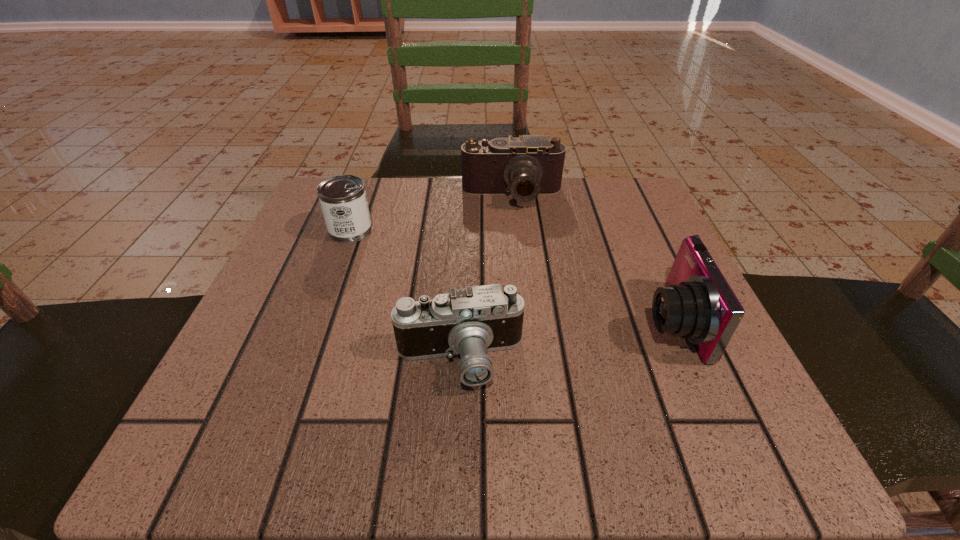
Find the location of a particular element. The width and height of the screenshot is (960, 540). can that is at the far edge is located at coordinates (343, 200).

Image resolution: width=960 pixels, height=540 pixels. I want to click on object present at the left edge, so click(343, 200).

The image size is (960, 540). Find the location of `object that is at the right edge`. object that is at the right edge is located at coordinates (698, 304).

The width and height of the screenshot is (960, 540). Find the location of `object at the far left corner`. object at the far left corner is located at coordinates (343, 200).

Locate an element on the screen. vacant space at the far edge of the desktop is located at coordinates (398, 205).

In the image, there is a desktop. At what (x,y) coordinates should I click in order to perform the action: click on vacant space at the near edge. Please return your answer as a coordinate pair (x, y). Looking at the image, I should click on (466, 451).

This screenshot has width=960, height=540. In the image, there is a desktop. What are the coordinates of `vacant space at the left edge` in the screenshot? It's located at (271, 370).

In the image, there is a desktop. Find the location of `free space at the right edge`. free space at the right edge is located at coordinates (588, 242).

Where is `vacant space at the far left corner`? vacant space at the far left corner is located at coordinates (325, 238).

Identify the location of vacant region between the can and the farthest camera. The height and width of the screenshot is (540, 960). (431, 213).